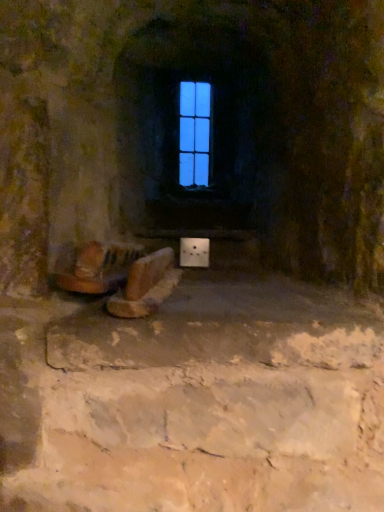
Question: Is blue glass window at center at the left side of wooden stool at lower center?

Choices:
 (A) no
 (B) yes

Answer: (A)

Question: Is blue glass window at center further to camera compared to wooden stool at lower center?

Choices:
 (A) no
 (B) yes

Answer: (B)

Question: Is blue glass window at center completely or partially outside of wooden stool at lower center?

Choices:
 (A) yes
 (B) no

Answer: (A)

Question: From a real-world perspective, is blue glass window at center located beneath wooden stool at lower center?

Choices:
 (A) no
 (B) yes

Answer: (A)

Question: Considering the relative sizes of blue glass window at center and wooden stool at lower center in the image provided, is blue glass window at center smaller than wooden stool at lower center?

Choices:
 (A) yes
 (B) no

Answer: (A)

Question: Considering the relative sizes of blue glass window at center and wooden stool at lower center in the image provided, is blue glass window at center taller than wooden stool at lower center?

Choices:
 (A) no
 (B) yes

Answer: (B)

Question: Does wooden stool at lower center have a larger size compared to blue glass window at center?

Choices:
 (A) no
 (B) yes

Answer: (B)

Question: From the image's perspective, is wooden stool at lower center beneath blue glass window at center?

Choices:
 (A) no
 (B) yes

Answer: (B)

Question: Is wooden stool at lower center far away from blue glass window at center?

Choices:
 (A) yes
 (B) no

Answer: (A)

Question: Is wooden stool at lower center smaller than blue glass window at center?

Choices:
 (A) no
 (B) yes

Answer: (A)

Question: Is wooden stool at lower center next to blue glass window at center and touching it?

Choices:
 (A) yes
 (B) no

Answer: (B)

Question: From the image's perspective, would you say wooden stool at lower center is positioned over blue glass window at center?

Choices:
 (A) yes
 (B) no

Answer: (B)

Question: In terms of size, does blue glass window at center appear bigger or smaller than wooden stool at lower center?

Choices:
 (A) small
 (B) big

Answer: (A)